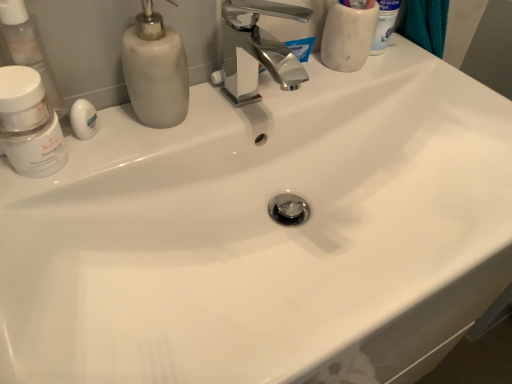
The width and height of the screenshot is (512, 384). Find the location of `vacant space to the right of white matte soap at left`. vacant space to the right of white matte soap at left is located at coordinates (191, 127).